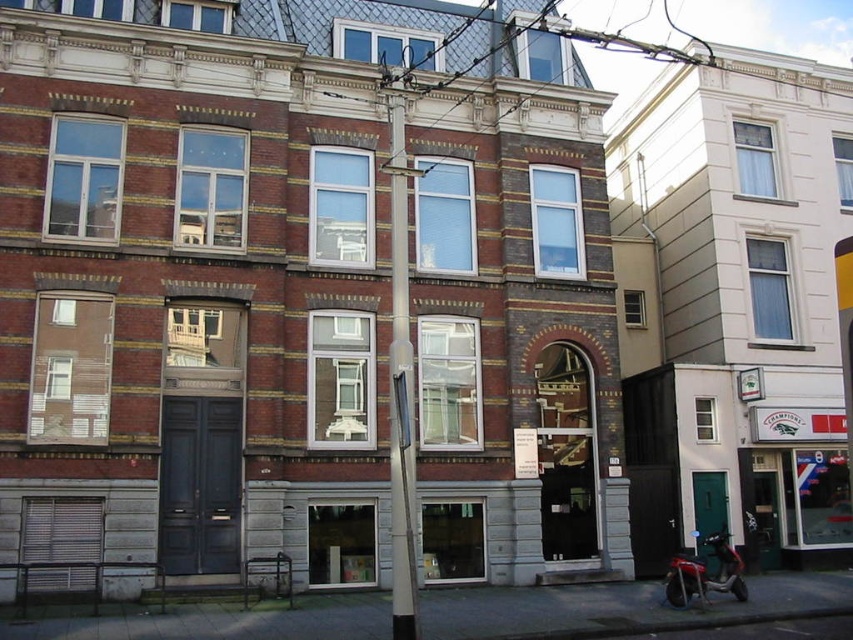
Between silver metallic pole at center and metallic red scooter at lower right, which one is positioned lower?

metallic red scooter at lower right

Does silver metallic pole at center appear over metallic red scooter at lower right?

Indeed, silver metallic pole at center is positioned over metallic red scooter at lower right.

Image resolution: width=853 pixels, height=640 pixels. I want to click on silver metallic pole at center, so click(x=399, y=388).